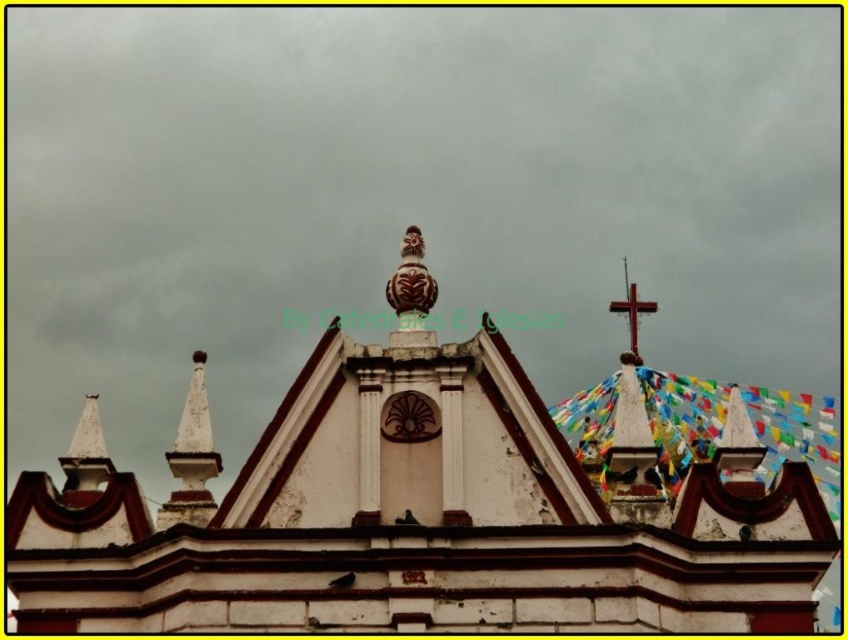
Question: Is white painted stone church at center positioned in front of wooden cross at upper right?

Choices:
 (A) yes
 (B) no

Answer: (A)

Question: Which of the following is the farthest from the observer?

Choices:
 (A) white painted stone church at center
 (B) wooden cross at upper right

Answer: (B)

Question: Which point is farther from the camera taking this photo?

Choices:
 (A) (612, 307)
 (B) (682, 577)

Answer: (A)

Question: Can you confirm if white painted stone church at center is thinner than wooden cross at upper right?

Choices:
 (A) yes
 (B) no

Answer: (B)

Question: Is white painted stone church at center smaller than wooden cross at upper right?

Choices:
 (A) yes
 (B) no

Answer: (B)